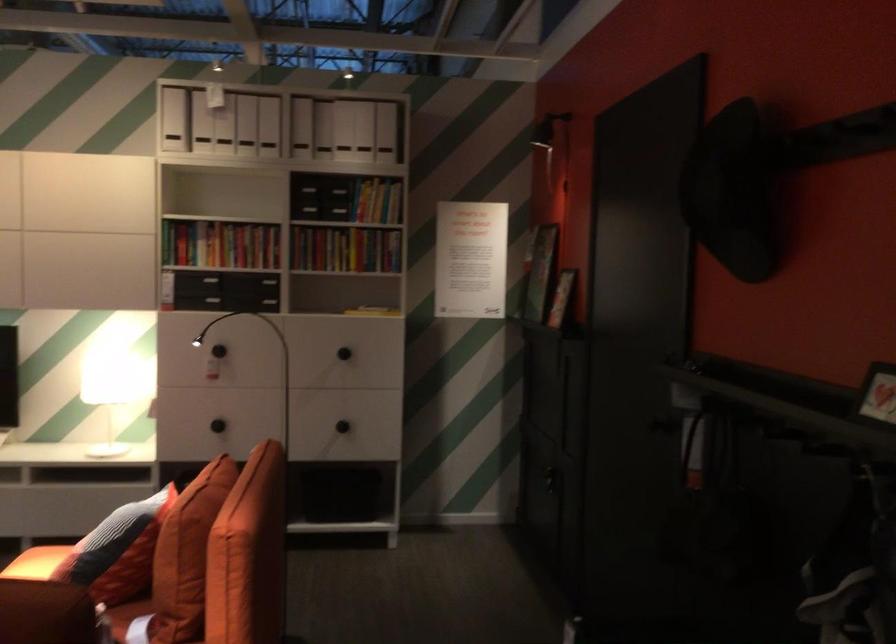
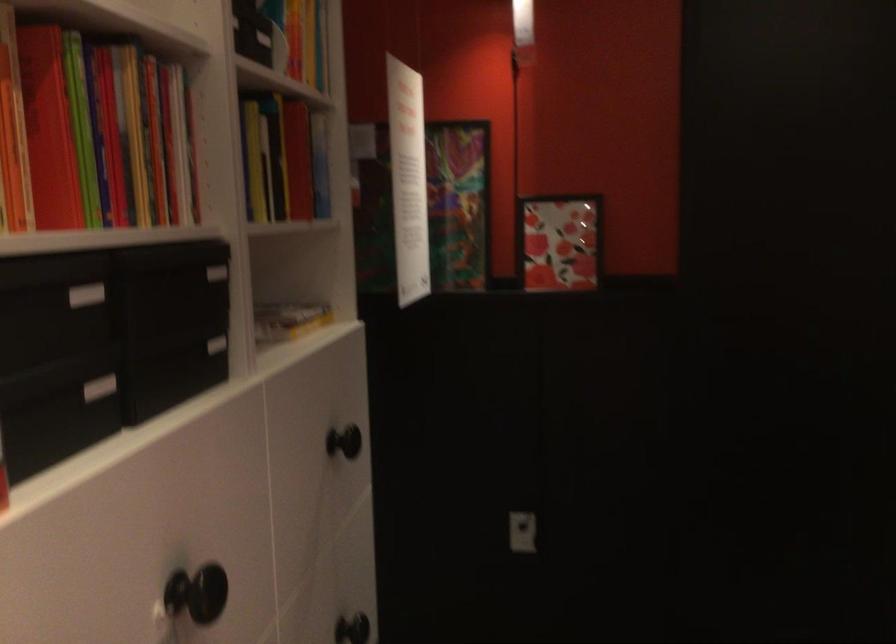
The point at (x=199, y=269) is marked in the first image. Where is the corresponding point in the second image?

(85, 295)